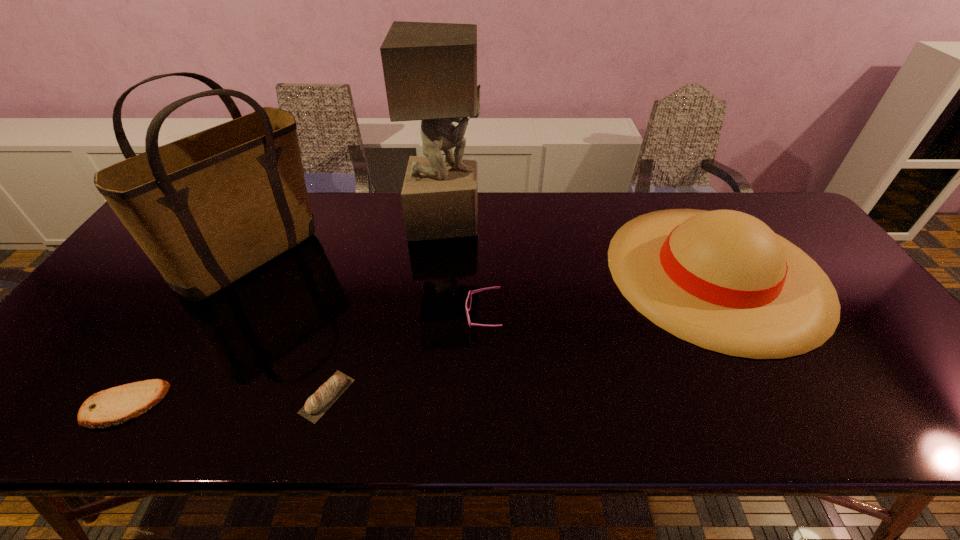
Locate an element on the screen. free space that is in between the sombrero and the sculpture is located at coordinates (581, 246).

This screenshot has height=540, width=960. Find the location of `free spot between the sombrero and the right pita bread`. free spot between the sombrero and the right pita bread is located at coordinates (521, 334).

Identify the location of empty space between the third object from left to right and the third tallest object. The image size is (960, 540). (521, 334).

The image size is (960, 540). I want to click on unoccupied area between the third object from left to right and the third shortest object, so click(x=405, y=356).

Image resolution: width=960 pixels, height=540 pixels. I want to click on the third closest object to the tote bag, so click(430, 69).

Find the location of a particular element. The width and height of the screenshot is (960, 540). object that is the fifth closest to the rightmost object is located at coordinates (107, 408).

This screenshot has height=540, width=960. I want to click on vacant region that satisfies the following two spatial constraints: 1. on the front-facing side of the sombrero; 2. on the right side of the sculpture, so click(x=442, y=272).

I want to click on vacant space that satisfies the following two spatial constraints: 1. on the front-facing side of the sculpture; 2. on the right side of the sombrero, so click(442, 272).

I want to click on vacant space that satisfies the following two spatial constraints: 1. on the front-facing side of the sculpture; 2. on the back side of the rightmost object, so click(442, 272).

Where is `vacant area in the image that satisfies the following two spatial constraints: 1. on the back side of the right pita bread; 2. on the left side of the sombrero`? Image resolution: width=960 pixels, height=540 pixels. vacant area in the image that satisfies the following two spatial constraints: 1. on the back side of the right pita bread; 2. on the left side of the sombrero is located at coordinates (362, 272).